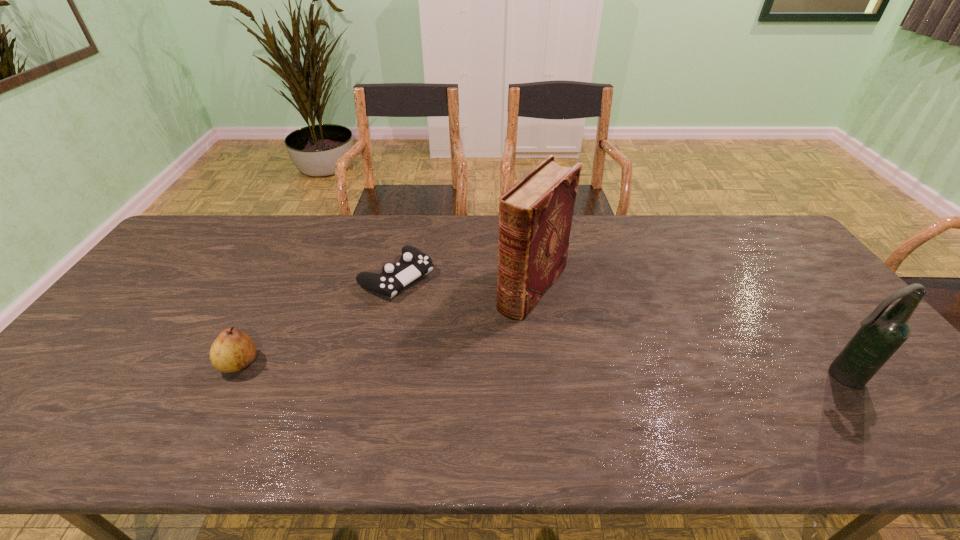
At what (x,y) coordinates should I click in order to perform the action: click on free space between the tallest object and the third object from right to left. Please return your answer as a coordinate pair (x, y). This screenshot has height=540, width=960. Looking at the image, I should click on (465, 282).

Find the location of `unoccupied area between the leftmost object and the third object from right to left`. unoccupied area between the leftmost object and the third object from right to left is located at coordinates (318, 320).

Find the location of a particular element. Image resolution: width=960 pixels, height=540 pixels. free area in between the hardback book and the beer bottle is located at coordinates (686, 332).

At what (x,y) coordinates should I click in order to perform the action: click on empty space that is in between the pear and the second tallest object. Please return your answer as a coordinate pair (x, y). Looking at the image, I should click on pyautogui.click(x=540, y=370).

Where is `free point between the pear and the rightmost object`? This screenshot has width=960, height=540. free point between the pear and the rightmost object is located at coordinates (540, 370).

The height and width of the screenshot is (540, 960). I want to click on vacant space that's between the control and the pear, so click(318, 320).

This screenshot has height=540, width=960. What are the coordinates of `object that is the closest one to the second object from left to right` in the screenshot? It's located at (535, 215).

The image size is (960, 540). I want to click on object that ranks as the third closest to the second object from right to left, so pos(232,351).

This screenshot has height=540, width=960. Find the location of `free location that satisfies the following two spatial constraints: 1. on the front side of the third tallest object; 2. on the left side of the third shortest object`. free location that satisfies the following two spatial constraints: 1. on the front side of the third tallest object; 2. on the left side of the third shortest object is located at coordinates (232, 376).

The height and width of the screenshot is (540, 960). What are the coordinates of `free spot that satisfies the following two spatial constraints: 1. on the back side of the pear; 2. on the left side of the second object from left to right` in the screenshot? It's located at (283, 277).